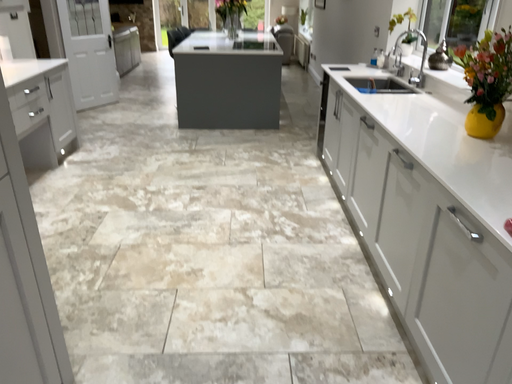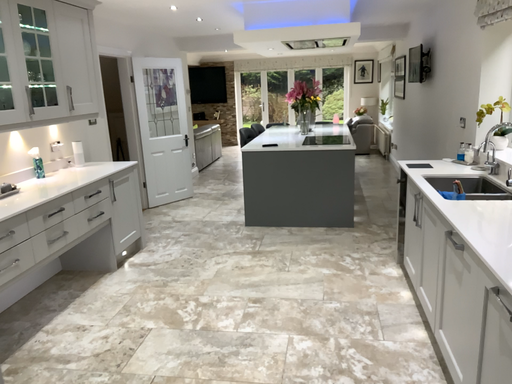
Question: Which way did the camera rotate in the video?

Choices:
 (A) rotated left
 (B) rotated right

Answer: (A)